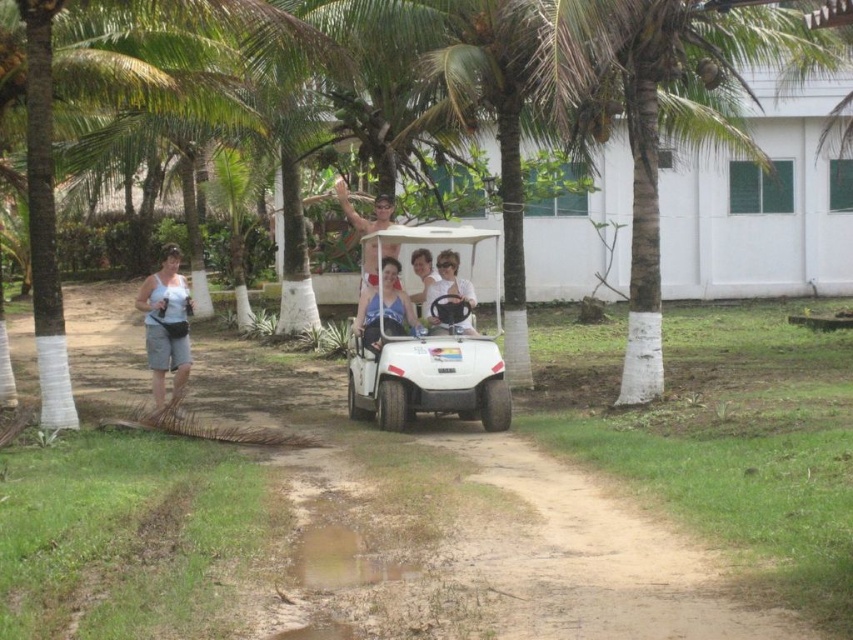
Which is more to the right, matte blue shirt at center or matte white steering wheel at center?

matte white steering wheel at center is more to the right.

Where is `matte blue shirt at center`? The image size is (853, 640). matte blue shirt at center is located at coordinates (386, 308).

This screenshot has height=640, width=853. Describe the element at coordinates (386, 308) in the screenshot. I see `matte blue shirt at center` at that location.

Where is `matte blue shirt at center`? matte blue shirt at center is located at coordinates (386, 308).

Which is behind, point (390, 268) or point (363, 275)?

The point (363, 275) is more distant.

Can you confirm if matte blue shirt at center is bigger than matte white golf cart at center?

Actually, matte blue shirt at center might be smaller than matte white golf cart at center.

Find the location of a particular element. This screenshot has height=640, width=853. matte blue shirt at center is located at coordinates (386, 308).

Between white fabric tank top at left and matte white steering wheel at center, which one appears on the left side from the viewer's perspective?

From the viewer's perspective, white fabric tank top at left appears more on the left side.

Who is shorter, white fabric tank top at left or matte white steering wheel at center?

matte white steering wheel at center is shorter.

Between point (173, 292) and point (450, 289), which one is positioned in front?

Positioned in front is point (173, 292).

Locate an element on the screen. white fabric tank top at left is located at coordinates (166, 324).